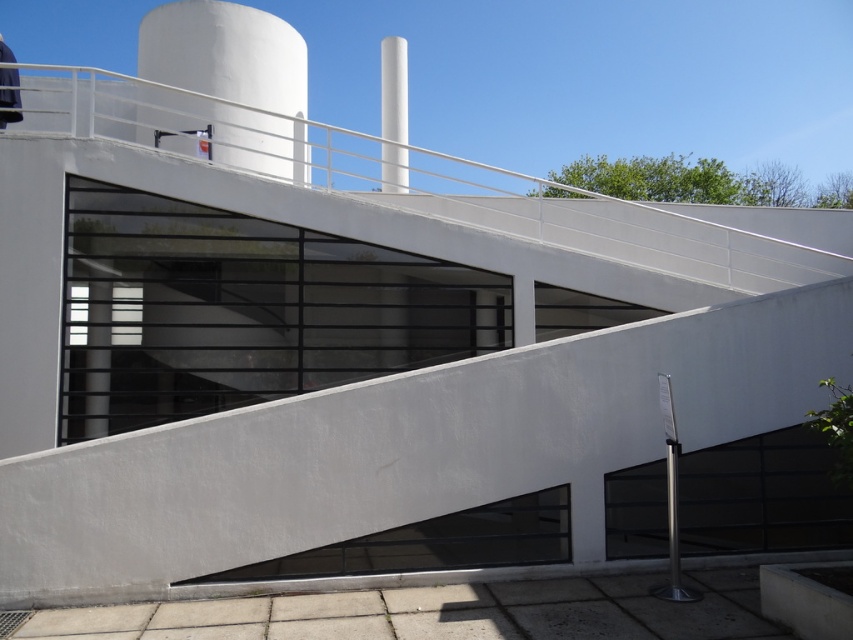
You are an engineer assessing the distance between the white smooth water tower at upper center and the nearest edge of the building. Can you confirm if the distance is more than 9 meters?

The distance between the white smooth water tower at upper center and the nearest edge of the building is 9.11 meters, which is more than 9 meters.

Looking at this image, you are standing in front of the modern building and see the point marked at coordinates (225, 52). What object is located at that point?

The white smooth water tower at upper center is located at the coordinates (225, 52).